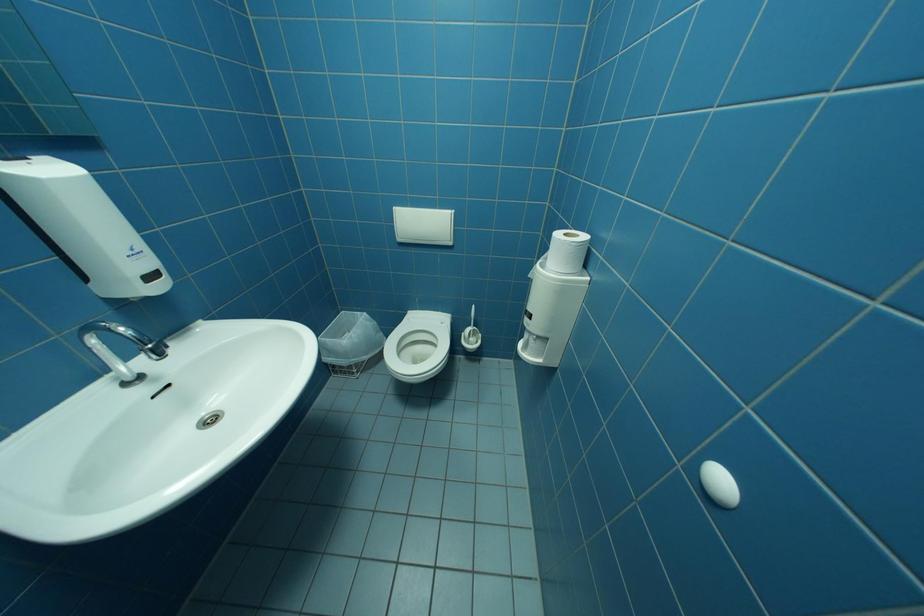
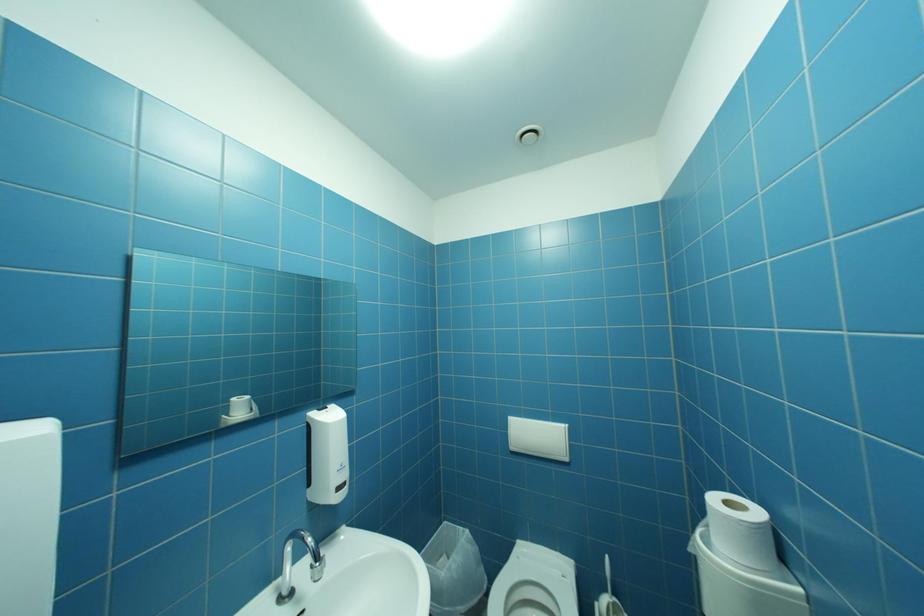
First-person continuous shooting, in which direction is the camera rotating?

The camera's rotation is toward left-up.